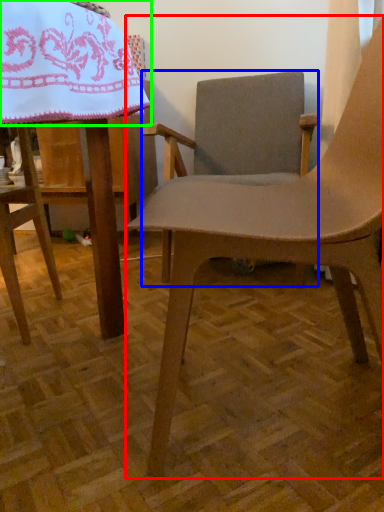
Question: Which object is the closest to the chair (highlighted by a red box)? Choose among these: chair (highlighted by a blue box) or blanket (highlighted by a green box).

Choices:
 (A) chair
 (B) blanket

Answer: (B)